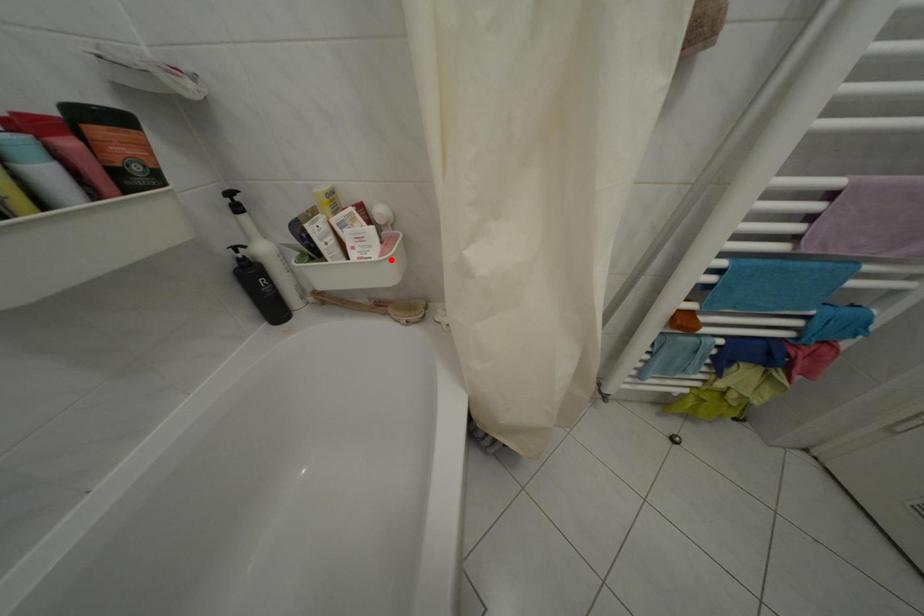
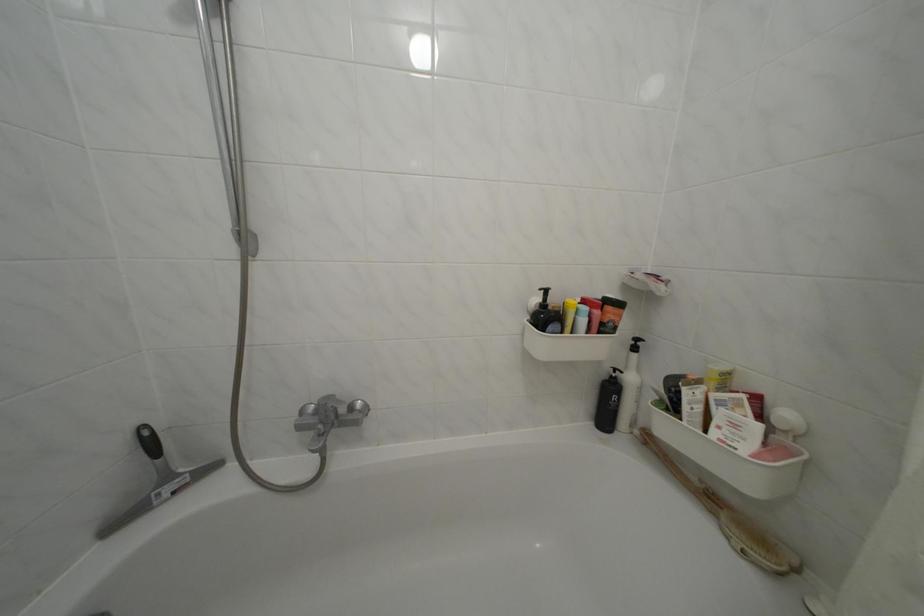
Find the pixel in the second image that matches the highlighted location in the first image.

(766, 462)